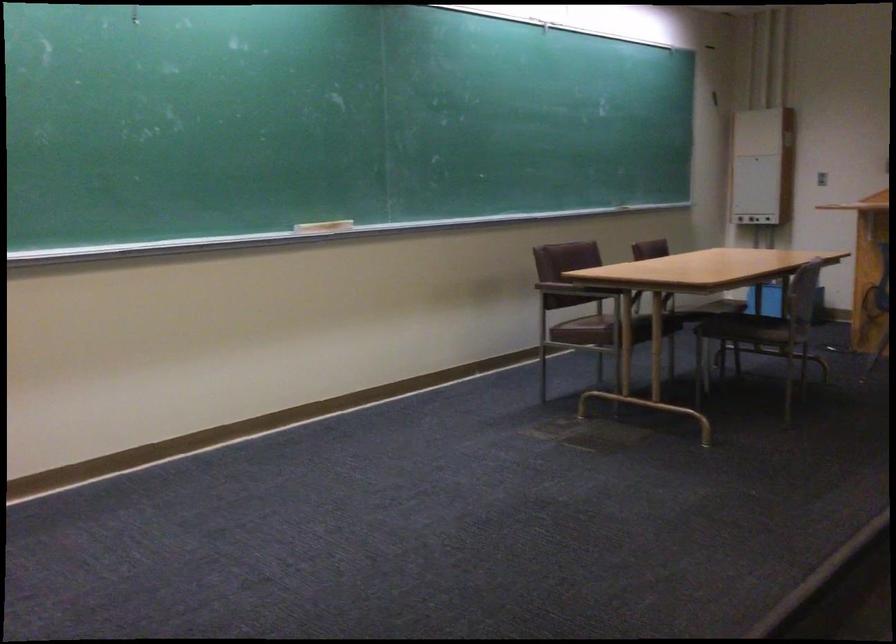
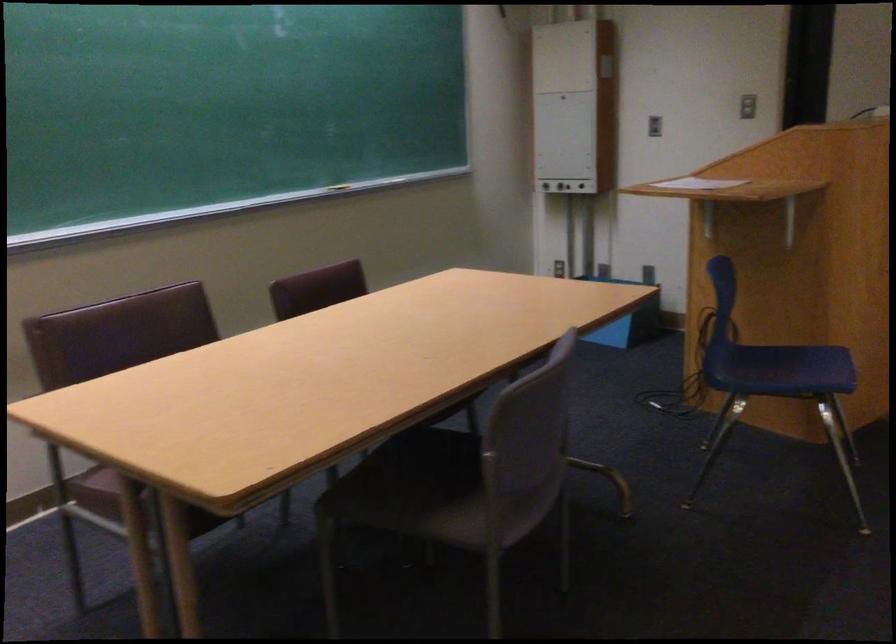
In the second image, find the point that corresponds to point 819,172 in the first image.

(653, 126)